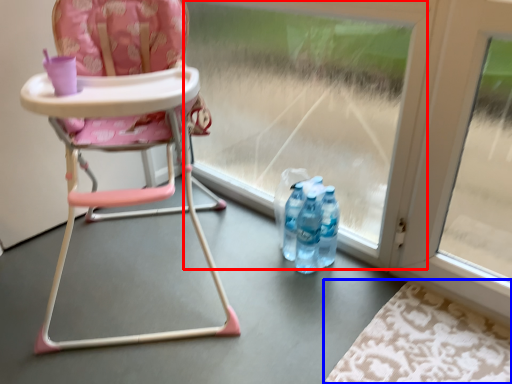
Question: Which point is further to the camera, glass door (highlighted by a red box) or mat (highlighted by a blue box)?

Choices:
 (A) glass door
 (B) mat

Answer: (A)